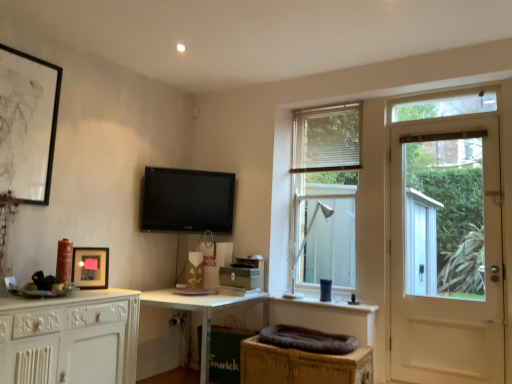
You are a GUI agent. You are given a task and a screenshot of the screen. Output one action in this format:
    pyautogui.click(x=<x>, y=<y>)
    Task: Click on the free point above brown wicker basket at lower center, marked as the second cabinetry in a left-to-right arrangement (from a real-world perspective)
    
    Given the screenshot: What is the action you would take?
    pyautogui.click(x=312, y=346)